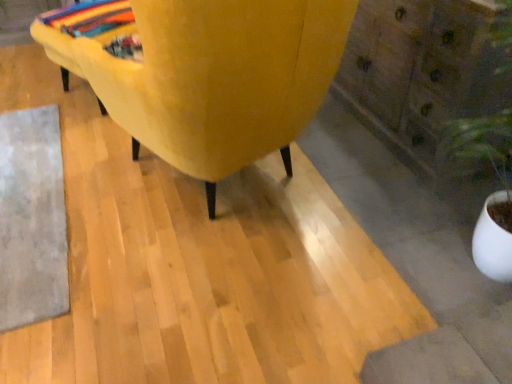
Locate an element on the screen. This screenshot has height=384, width=512. free spot behind gray woolen mat at lower left is located at coordinates (66, 111).